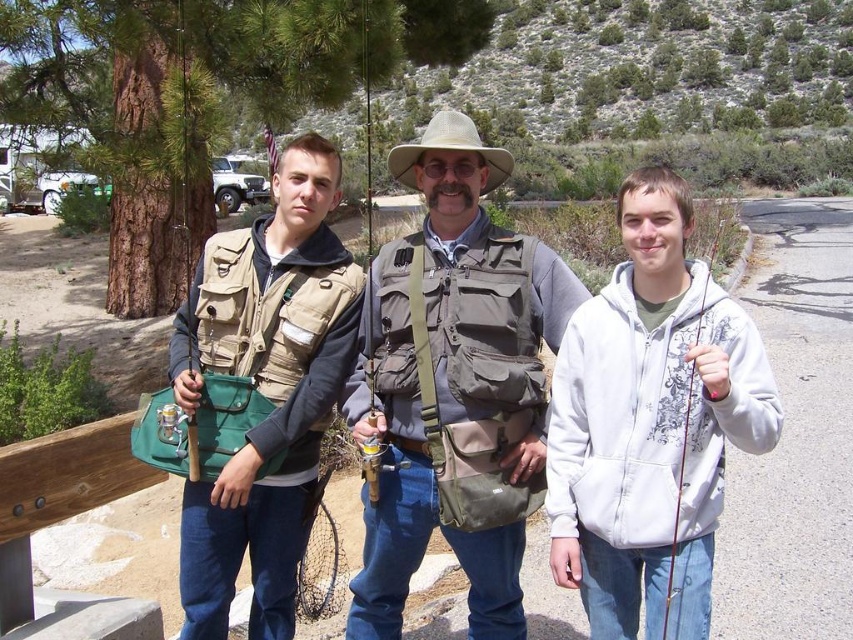
Is point (647, 352) positioned after point (381, 323)?

That is False.

Is white fleece hoodie at right below matte khaki vest at center?

Yes, white fleece hoodie at right is below matte khaki vest at center.

Locate an element on the screen. white fleece hoodie at right is located at coordinates (650, 422).

Who is taller, white fleece hoodie at right or tan canvas cowboy hat at center?

Standing taller between the two is tan canvas cowboy hat at center.

Who is lower down, white fleece hoodie at right or tan canvas cowboy hat at center?

Positioned lower is white fleece hoodie at right.

Identify the location of white fleece hoodie at right. The width and height of the screenshot is (853, 640). (650, 422).

From the picture: Can you confirm if tan canvas cowboy hat at center is positioned to the right of matte brown fishing pole at right?

Incorrect, tan canvas cowboy hat at center is not on the right side of matte brown fishing pole at right.

Does tan canvas cowboy hat at center appear over matte brown fishing pole at right?

Yes.

The width and height of the screenshot is (853, 640). What do you see at coordinates (450, 148) in the screenshot?
I see `tan canvas cowboy hat at center` at bounding box center [450, 148].

Locate an element on the screen. The height and width of the screenshot is (640, 853). tan canvas cowboy hat at center is located at coordinates pyautogui.click(x=450, y=148).